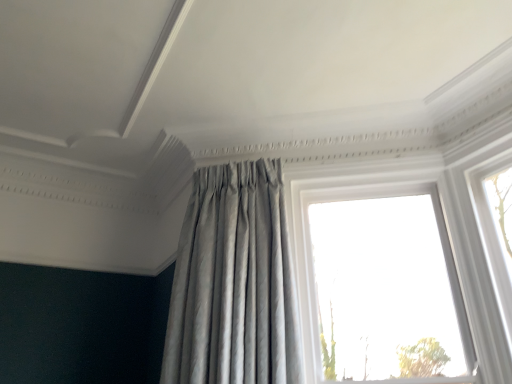
Question: Considering the positions of satin silver curtain at center and transparent glass window at upper right in the image, is satin silver curtain at center bigger or smaller than transparent glass window at upper right?

Choices:
 (A) big
 (B) small

Answer: (A)

Question: Is satin silver curtain at center taller or shorter than transparent glass window at upper right?

Choices:
 (A) short
 (B) tall

Answer: (A)

Question: Is point (204, 266) closer or farther from the camera than point (437, 173)?

Choices:
 (A) closer
 (B) farther

Answer: (A)

Question: Considering the positions of point (377, 306) and point (292, 362), is point (377, 306) closer or farther from the camera than point (292, 362)?

Choices:
 (A) closer
 (B) farther

Answer: (B)

Question: Is transparent glass window at upper right inside the boundaries of satin silver curtain at center, or outside?

Choices:
 (A) inside
 (B) outside

Answer: (B)

Question: From their relative heights in the image, would you say transparent glass window at upper right is taller or shorter than satin silver curtain at center?

Choices:
 (A) tall
 (B) short

Answer: (A)

Question: From a real-world perspective, relative to satin silver curtain at center, is transparent glass window at upper right vertically above or below?

Choices:
 (A) above
 (B) below

Answer: (B)